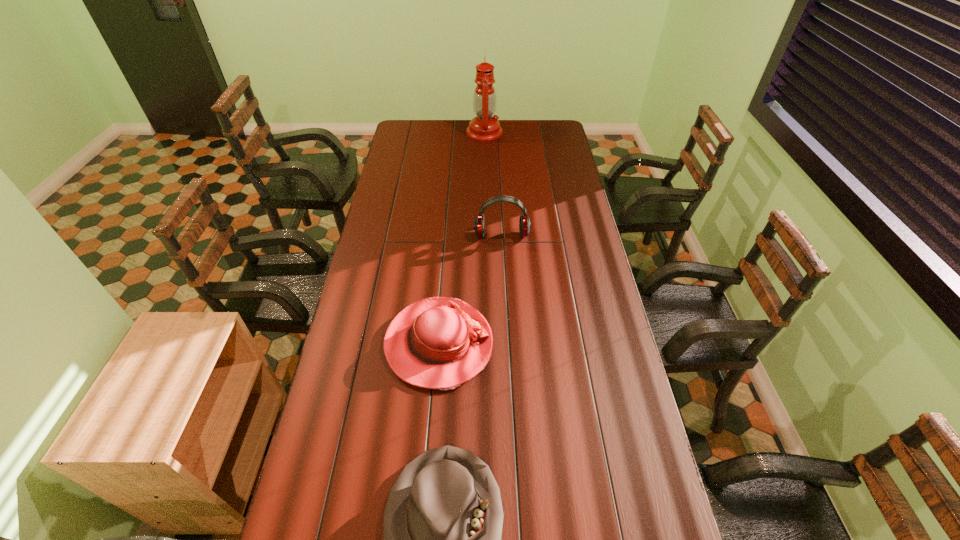
Identify the location of vacant space at the left edge of the desktop. click(x=386, y=240).

Image resolution: width=960 pixels, height=540 pixels. In the image, there is a desktop. Identify the location of vacant space at the right edge. (596, 288).

You are a GUI agent. You are given a task and a screenshot of the screen. Output one action in this format:
    pyautogui.click(x=<x>, y=<y>)
    Task: Click on the empty space between the earphone and the tallest object
    The width and height of the screenshot is (960, 540).
    Given the screenshot: What is the action you would take?
    pyautogui.click(x=493, y=184)

Find the location of `free spot between the earphone and the farthest object`. free spot between the earphone and the farthest object is located at coordinates tap(493, 184).

Find the location of `vacant area between the earphone and the second nearest object`. vacant area between the earphone and the second nearest object is located at coordinates (470, 289).

Locate an element on the screen. free spot between the oil lamp and the farther hat is located at coordinates (462, 238).

Find the location of a particular element. The height and width of the screenshot is (540, 960). blank region between the third nearest object and the tallest object is located at coordinates point(493,184).

Where is `the third closest object to the second nearest object`? the third closest object to the second nearest object is located at coordinates (484, 127).

Point out which object is positioned as the nearest to the tallest object. Please provide its 2D coordinates. Your answer should be formatted as a tuple, i.e. [(x, y)], where the tuple contains the x and y coordinates of a point satisfying the conditions above.

[(524, 223)]

This screenshot has width=960, height=540. I want to click on free space that satisfies the following two spatial constraints: 1. on the ear cups of the third shortest object; 2. at the front of the third farthest object with a bow, so click(508, 344).